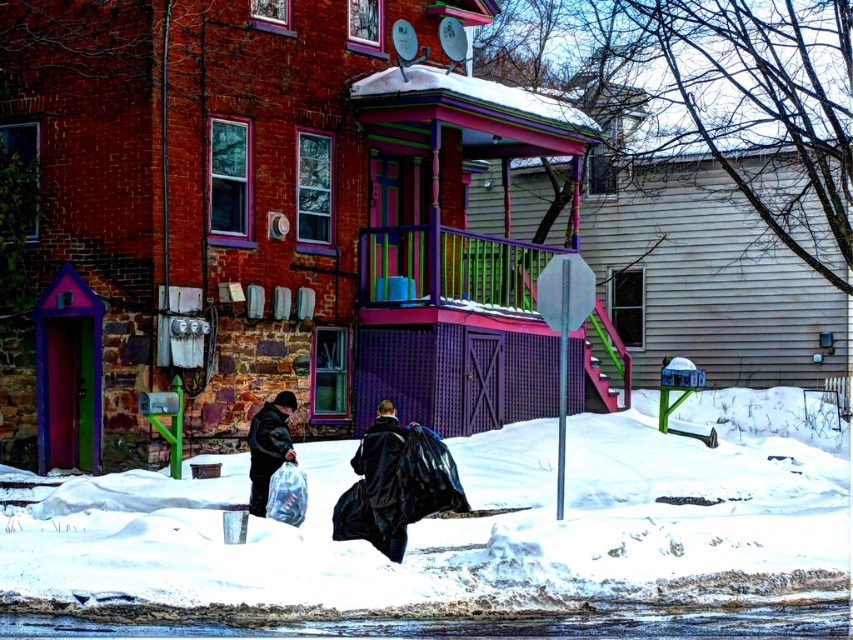
You are a delivery person trying to navigate to the house with the pink porch roof. You see the white fluffy snow at lower center and the matte black jacket at lower left. Which object is bigger in size?

The white fluffy snow at lower center is larger in size compared to the matte black jacket at lower left according to the description.

You are a delivery person trying to navigate to the house with the pink porch roof. You see the white fluffy snow at lower center and the matte black jacket at lower left. Which object is taller?

The white fluffy snow at lower center is taller than the matte black jacket at lower left according to the description.